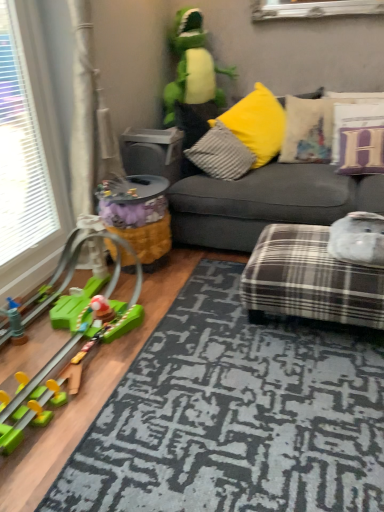
This screenshot has width=384, height=512. I want to click on vacant area that lies between yellow fabric toy at center, placed as the second toy when sorted from bottom to top, and dark gray textured rug at lower center, so click(x=127, y=329).